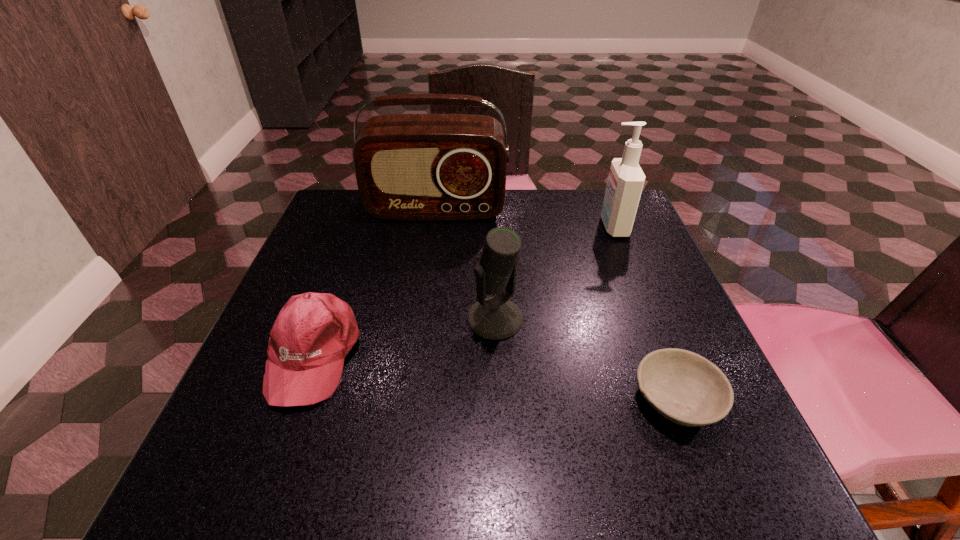
Where is `vacant space at the far edge`? The image size is (960, 540). vacant space at the far edge is located at coordinates (439, 224).

Locate an element on the screen. The height and width of the screenshot is (540, 960). vacant region at the near edge is located at coordinates (407, 473).

Identify the location of free spot at the left edge of the desktop. This screenshot has width=960, height=540. (360, 287).

Find the location of a particular element. free location at the right edge of the desktop is located at coordinates (668, 321).

Identify the location of blank space at the far left corner of the desktop. This screenshot has height=540, width=960. (325, 206).

Image resolution: width=960 pixels, height=540 pixels. What are the coordinates of `vacant space at the near right corner` in the screenshot? It's located at (770, 475).

Locate an element on the screen. The height and width of the screenshot is (540, 960). free spot between the cleansing agent and the bowl is located at coordinates (645, 313).

What are the coordinates of `free spot between the bowl and the cleansing agent` in the screenshot? It's located at (645, 313).

Find the location of `unoccupied position between the microphone and the bowl`. unoccupied position between the microphone and the bowl is located at coordinates (586, 359).

Find the location of a particular element. unoccupied position between the bowl and the third tallest object is located at coordinates (586, 359).